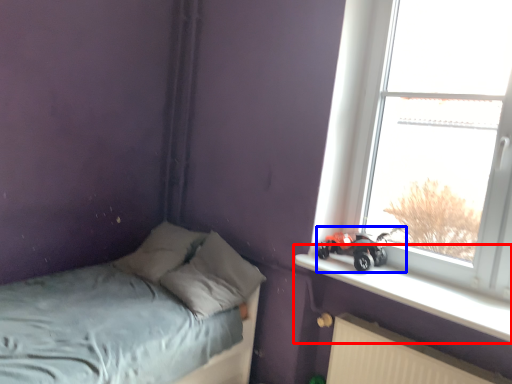
Question: Which object appears closest to the camera in this image, window sill (highlighted by a red box) or land vehicle (highlighted by a blue box)?

Choices:
 (A) window sill
 (B) land vehicle

Answer: (A)